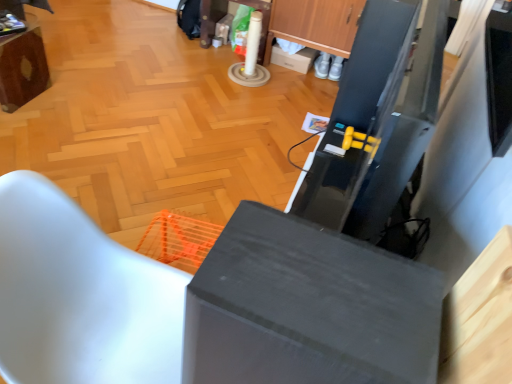
Describe the element at coordinates (22, 66) in the screenshot. I see `wooden table at upper left, the 1th furniture viewed from the left` at that location.

Measure the distance between point (17,226) and camera.

The depth of point (17,226) is 37.52 inches.

The height and width of the screenshot is (384, 512). What do you see at coordinates (308, 308) in the screenshot?
I see `matte gray cabinet at center` at bounding box center [308, 308].

At what (x,y) coordinates should I click in order to perform the action: click on wooden table at upper left, positioned as the 1th furniture in back-to-front order. Please return your answer as a coordinate pair (x, y). The height and width of the screenshot is (384, 512). Looking at the image, I should click on pyautogui.click(x=22, y=66).

How different are the orientations of white matte chair at lower left, the second furniture when ordered from left to right, and white cardboard box at center in degrees?

The angle between the facing direction of white matte chair at lower left, the second furniture when ordered from left to right, and the facing direction of white cardboard box at center is 89.9 degrees.

Consider the image. Can white cardboard box at center be found inside white matte chair at lower left, positioned as the 1th furniture in right-to-left order?

That's incorrect, white cardboard box at center is not inside white matte chair at lower left, positioned as the 1th furniture in right-to-left order.

Considering the positions of objects white matte chair at lower left, the 2th furniture in the back-to-front sequence, and white cardboard box at center in the image provided, who is behind, white matte chair at lower left, the 2th furniture in the back-to-front sequence, or white cardboard box at center?

white cardboard box at center is further away from the camera.

Is white matte chair at lower left, arranged as the first furniture when viewed from the front, facing away from white cardboard box at center?

white matte chair at lower left, arranged as the first furniture when viewed from the front, is not turned away from white cardboard box at center.

From the picture: Is wooden table at upper left, placed as the first furniture when sorted from top to bottom, positioned far away from white matte chair at lower left, marked as the 1th furniture in a bottom-to-top arrangement?

Absolutely, wooden table at upper left, placed as the first furniture when sorted from top to bottom, is distant from white matte chair at lower left, marked as the 1th furniture in a bottom-to-top arrangement.

Is wooden table at upper left, placed as the first furniture when sorted from top to bottom, facing towards white matte chair at lower left, positioned as the 1th furniture in right-to-left order?

No, wooden table at upper left, placed as the first furniture when sorted from top to bottom, is not facing towards white matte chair at lower left, positioned as the 1th furniture in right-to-left order.

Considering the relative sizes of wooden table at upper left, arranged as the 2th furniture when viewed from the right, and white matte chair at lower left, positioned as the 1th furniture in right-to-left order, in the image provided, is wooden table at upper left, arranged as the 2th furniture when viewed from the right, taller than white matte chair at lower left, positioned as the 1th furniture in right-to-left order,?

No.

Could wooden table at upper left, arranged as the 2th furniture when viewed from the front, be considered to be inside white cardboard box at center?

Definitely not — wooden table at upper left, arranged as the 2th furniture when viewed from the front, is not inside white cardboard box at center.

Considering the relative sizes of white cardboard box at center and wooden table at upper left, positioned as the 1th furniture in back-to-front order, in the image provided, is white cardboard box at center taller than wooden table at upper left, positioned as the 1th furniture in back-to-front order,?

In fact, white cardboard box at center may be shorter than wooden table at upper left, positioned as the 1th furniture in back-to-front order.

Between white cardboard box at center and wooden table at upper left, the 1th furniture viewed from the left, which one has smaller width?

Thinner between the two is white cardboard box at center.

Are white cardboard box at center and wooden table at upper left, arranged as the 2th furniture when viewed from the right, located far from each other?

Yes, white cardboard box at center and wooden table at upper left, arranged as the 2th furniture when viewed from the right, are located far from each other.

Does wooden table at upper left, the 1th furniture viewed from the left, have a greater height compared to white cardboard box at center?

Indeed, wooden table at upper left, the 1th furniture viewed from the left, has a greater height compared to white cardboard box at center.

From the image's perspective, which is below, wooden table at upper left, placed as the first furniture when sorted from top to bottom, or white cardboard box at center?

wooden table at upper left, placed as the first furniture when sorted from top to bottom.

Which is behind, wooden table at upper left, the 1th furniture viewed from the left, or white cardboard box at center?

white cardboard box at center is further away from the camera.

In terms of size, does wooden table at upper left, the 1th furniture viewed from the left, appear bigger or smaller than white cardboard box at center?

wooden table at upper left, the 1th furniture viewed from the left, is bigger than white cardboard box at center.

From a real-world perspective, which is physically above, wooden table at upper left, arranged as the 2th furniture when viewed from the front, or wooden cabinet at upper center?

wooden cabinet at upper center is physically above.

Based on the photo, is wooden table at upper left, the 1th furniture viewed from the left, taller or shorter than wooden cabinet at upper center?

In the image, wooden table at upper left, the 1th furniture viewed from the left, appears to be shorter than wooden cabinet at upper center.

Is wooden table at upper left, which is the 2th furniture from bottom to top, directly adjacent to wooden cabinet at upper center?

wooden table at upper left, which is the 2th furniture from bottom to top, and wooden cabinet at upper center are not in contact.

Is point (4, 90) behind point (321, 38)?

That is False.

Is wooden cabinet at upper center positioned with its back to white matte chair at lower left, the 2th furniture in the back-to-front sequence?

That's not correct — wooden cabinet at upper center is not looking away from white matte chair at lower left, the 2th furniture in the back-to-front sequence.

Looking at this image, would you say wooden cabinet at upper center is a long distance from white matte chair at lower left, the 2th furniture in the back-to-front sequence?

Yes, wooden cabinet at upper center and white matte chair at lower left, the 2th furniture in the back-to-front sequence, are located far from each other.

Would you say wooden cabinet at upper center is outside white matte chair at lower left, the 2th furniture in the back-to-front sequence?

Yes, wooden cabinet at upper center is located beyond the bounds of white matte chair at lower left, the 2th furniture in the back-to-front sequence.

How different are the orientations of wooden cabinet at upper center and white matte chair at lower left, the second furniture when ordered from left to right, in degrees?

wooden cabinet at upper center and white matte chair at lower left, the second furniture when ordered from left to right, are facing 89.5 degrees away from each other.

Is matte gray cabinet at center a part of wooden cabinet at upper center?

That's incorrect, matte gray cabinet at center is not inside wooden cabinet at upper center.

Measure the distance from wooden cabinet at upper center to matte gray cabinet at center.

The distance of wooden cabinet at upper center from matte gray cabinet at center is 2.48 meters.

Find the location of a particular element. drawer that is above the matte gray cabinet at center (from the image's perspective) is located at coordinates (316, 24).

In order to click on box on the right of white matte chair at lower left, arranged as the first furniture when viewed from the front in this screenshot , I will do `click(294, 58)`.

Locate an element on the screen. furniture below the wooden table at upper left, arranged as the 2th furniture when viewed from the front (from the image's perspective) is located at coordinates coord(80,296).

When comparing their distances from white cardboard box at center, does white matte chair at lower left, marked as the 1th furniture in a bottom-to-top arrangement, or matte gray cabinet at center seem further?

matte gray cabinet at center.

Looking at the image, which one is located closer to matte gray cabinet at center, wooden table at upper left, positioned as the 1th furniture in back-to-front order, or white cardboard box at center?

wooden table at upper left, positioned as the 1th furniture in back-to-front order, is positioned closer to the anchor matte gray cabinet at center.

From the image, which object appears to be nearer to wooden table at upper left, arranged as the 2th furniture when viewed from the right, white cardboard box at center or white matte chair at lower left, marked as the 1th furniture in a bottom-to-top arrangement?

The object closer to wooden table at upper left, arranged as the 2th furniture when viewed from the right, is white cardboard box at center.

Estimate the real-world distances between objects in this image. Which object is further from white matte chair at lower left, the second furniture when ordered from left to right, wooden table at upper left, placed as the first furniture when sorted from top to bottom, or white cardboard box at center?

white cardboard box at center is positioned further to the anchor white matte chair at lower left, the second furniture when ordered from left to right.

From the image, which object appears to be nearer to matte gray cabinet at center, wooden cabinet at upper center or white cardboard box at center?

wooden cabinet at upper center is closer to matte gray cabinet at center.

Looking at the image, which one is located further to white matte chair at lower left, the 2th furniture in the back-to-front sequence, white cardboard box at center or wooden cabinet at upper center?

Among the two, white cardboard box at center is located further to white matte chair at lower left, the 2th furniture in the back-to-front sequence.

In the scene shown: When comparing their distances from matte gray cabinet at center, does wooden cabinet at upper center or white matte chair at lower left, the 2th furniture in the back-to-front sequence, seem further?

wooden cabinet at upper center is further to matte gray cabinet at center.

Which object lies nearer to the anchor point wooden table at upper left, placed as the first furniture when sorted from top to bottom, matte gray cabinet at center or white cardboard box at center?

The object closer to wooden table at upper left, placed as the first furniture when sorted from top to bottom, is white cardboard box at center.

Where is `furniture between matte gray cabinet at center and wooden table at upper left, positioned as the 1th furniture in back-to-front order, from front to back`? furniture between matte gray cabinet at center and wooden table at upper left, positioned as the 1th furniture in back-to-front order, from front to back is located at coordinates (80, 296).

Where is `furniture between white matte chair at lower left, arranged as the 2th furniture when viewed from the top, and white cardboard box at center in the front-back direction`? This screenshot has width=512, height=384. furniture between white matte chair at lower left, arranged as the 2th furniture when viewed from the top, and white cardboard box at center in the front-back direction is located at coordinates (22, 66).

The height and width of the screenshot is (384, 512). Identify the location of box between wooden table at upper left, positioned as the 1th furniture in back-to-front order, and wooden cabinet at upper center from left to right. (294, 58).

This screenshot has width=512, height=384. I want to click on drawer between matte gray cabinet at center and white cardboard box at center from front to back, so click(x=316, y=24).